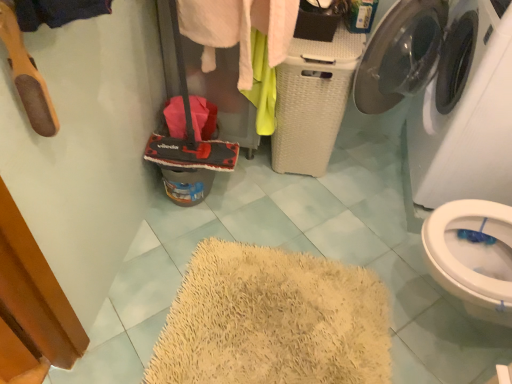
Question: Relative to red fabric mop at center-left, is soft pink towel at center in front or behind?

Choices:
 (A) front
 (B) behind

Answer: (B)

Question: Considering the positions of soft pink towel at center and red fabric mop at center-left in the image, is soft pink towel at center wider or thinner than red fabric mop at center-left?

Choices:
 (A) thin
 (B) wide

Answer: (B)

Question: Which of these objects is positioned closest to the white glossy washing machine at upper right?

Choices:
 (A) soft pink towel at center
 (B) red fabric mop at center-left

Answer: (A)

Question: Which object is the closest to the soft pink towel at center?

Choices:
 (A) red fabric mop at center-left
 (B) white glossy washing machine at upper right

Answer: (A)